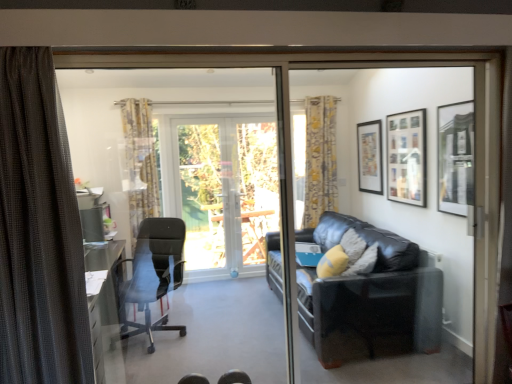
Question: From their relative heights in the image, would you say black leather couch at right is taller or shorter than black leather couch at right, placed as the second screen door when sorted from left to right?

Choices:
 (A) short
 (B) tall

Answer: (A)

Question: Do you think black leather couch at right is within black leather couch at right, which is the first screen door from right to left, or outside of it?

Choices:
 (A) inside
 (B) outside

Answer: (B)

Question: Estimate the real-world distances between objects in this image. Which object is farther from the black leather couch at right, which is the first screen door from right to left?

Choices:
 (A) matte black office chair at center, the second chair positioned from the left
 (B) black mesh office chair at left, which is counted as the 1th chair, starting from the left
 (C) transparent glass screen door at center, the first screen door in the left-to-right sequence
 (D) transparent glass door at center
 (E) yellow floral fabric curtain at left, which appears as the 2th curtain when viewed from the back

Answer: (A)

Question: Estimate the real-world distances between objects in this image. Which object is closer to the matte black office chair at center, which ranks as the 1th chair in bottom-to-top order?

Choices:
 (A) black leather couch at right
 (B) yellow floral fabric curtain at left, which appears as the 2th curtain when viewed from the back
 (C) matte black picture frame at upper right, which is the 2th picture frame from back to front
 (D) black textured curtain at left, which is counted as the first curtain, starting from the front
 (E) matte black picture frame at upper right, the 1th picture frame when ordered from back to front

Answer: (A)